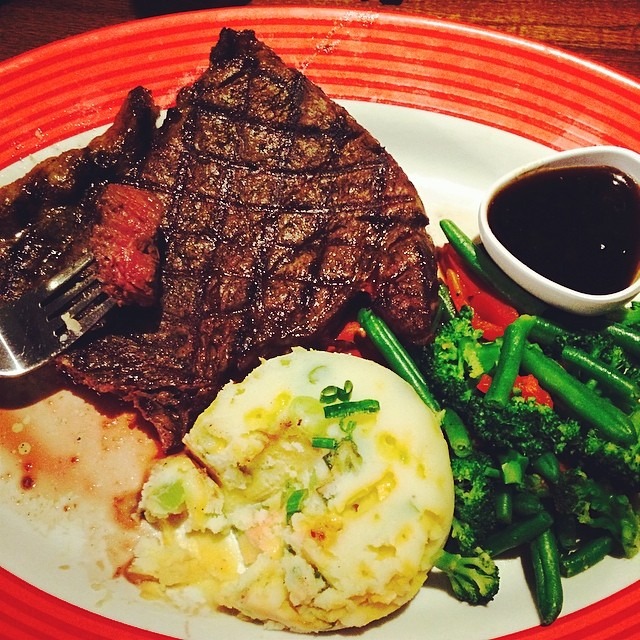
This screenshot has width=640, height=640. I want to click on fork, so click(x=22, y=333).